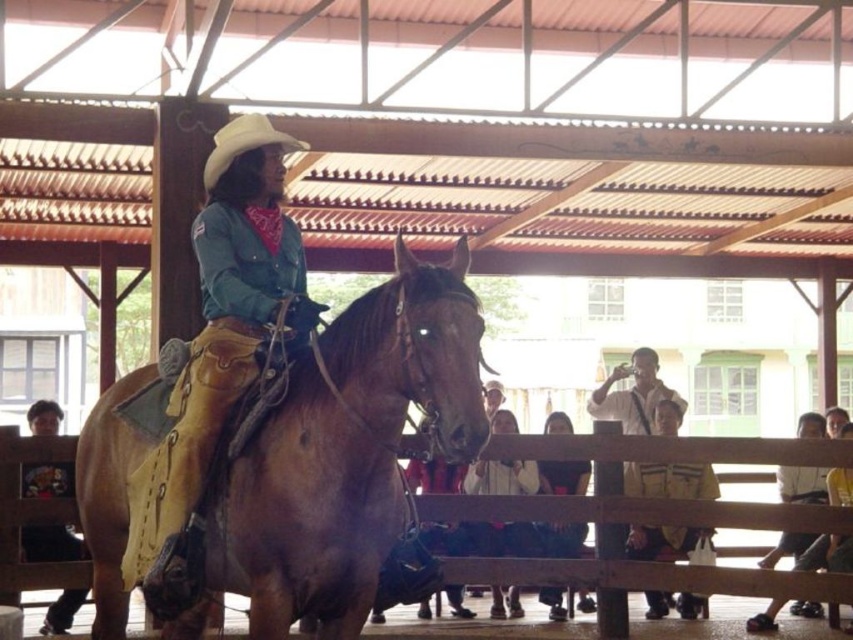
You are an event organizer planning to set up a banner between the wooden fence at lower center and the matte black jacket at center. Given that the banner requires a minimum of 1 meter in width to be visible, can the space between them accommodate it?

The wooden fence at lower center is wider than the matte black jacket at center. However, without specific measurements, it is impossible to determine if the space between them meets the banner requirement of 1 meter in width. Additional information is needed to confirm.

You are a photographer at the rodeo event and want to capture a closeup of the matte brown leather cowboy hat at upper center and matte black jacket at center. Which object should you zoom in on to ensure both are in frame without moving the camera?

→ The matte brown leather cowboy hat at upper center has a larger width than the matte black jacket at center, so you should zoom in on the matte brown leather cowboy hat at upper center to ensure both are in frame without moving the camera.

You are a photographer standing at the back of the rodeo arena. You want to take a photo of the brown leather horse at center and the white cotton shirt at center. Which object should you focus on first if you want to capture both clearly in your shot?

The brown leather horse at center is bigger than the white cotton shirt at center, so you should focus on the brown leather horse at center first to ensure it is in clear focus before adjusting for the smaller white cotton shirt at center.